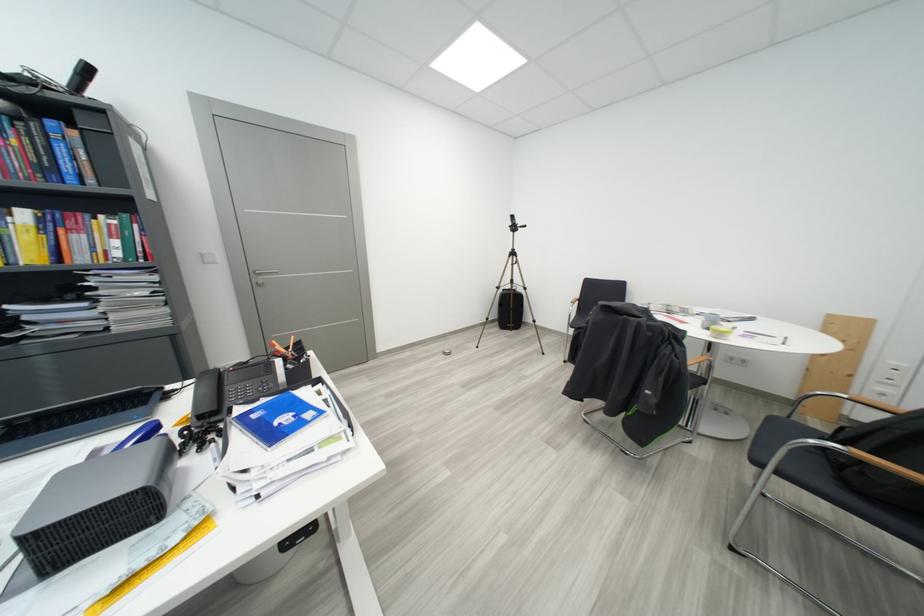
The location [125,233] corresponds to which object?

This point indicates the red hardcover book.